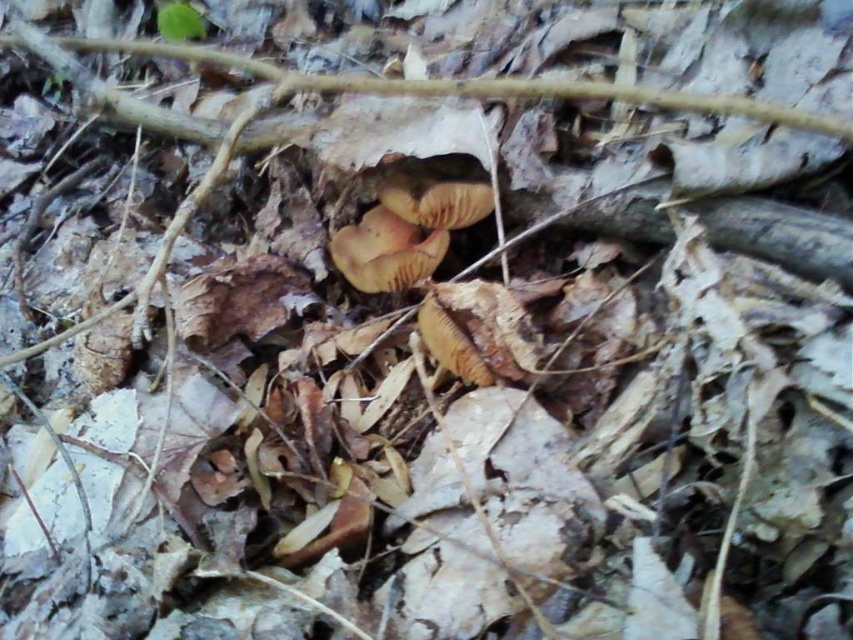
Question: Among these objects, which one is farthest from the camera?

Choices:
 (A) smooth orange cap at center
 (B) brown fuzzy mushroom at center
 (C) brown matte fungi at center

Answer: (C)

Question: Can you confirm if brown matte fungi at center is wider than brown fuzzy mushroom at center?

Choices:
 (A) yes
 (B) no

Answer: (A)

Question: Estimate the real-world distances between objects in this image. Which object is farther from the brown matte twig at upper center?

Choices:
 (A) brown matte fungi at center
 (B) smooth orange cap at center

Answer: (A)

Question: Does brown matte fungi at center appear over brown fuzzy mushroom at center?

Choices:
 (A) no
 (B) yes

Answer: (B)

Question: Which of these objects is positioned closest to the brown matte fungi at center?

Choices:
 (A) brown matte twig at upper center
 (B) brown fuzzy mushroom at center
 (C) smooth orange cap at center

Answer: (C)

Question: Is brown matte fungi at center above brown fuzzy mushroom at center?

Choices:
 (A) yes
 (B) no

Answer: (A)